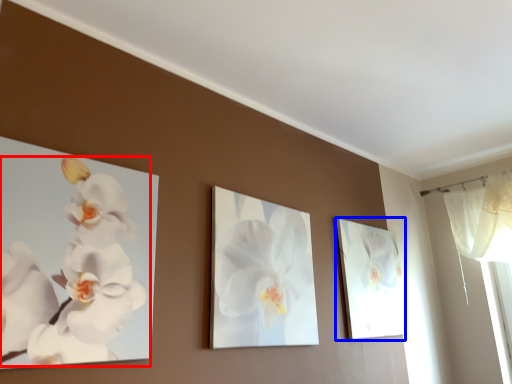
Question: Which of the following is the farthest to the observer, flower (highlighted by a red box) or picture frame (highlighted by a blue box)?

Choices:
 (A) flower
 (B) picture frame

Answer: (B)